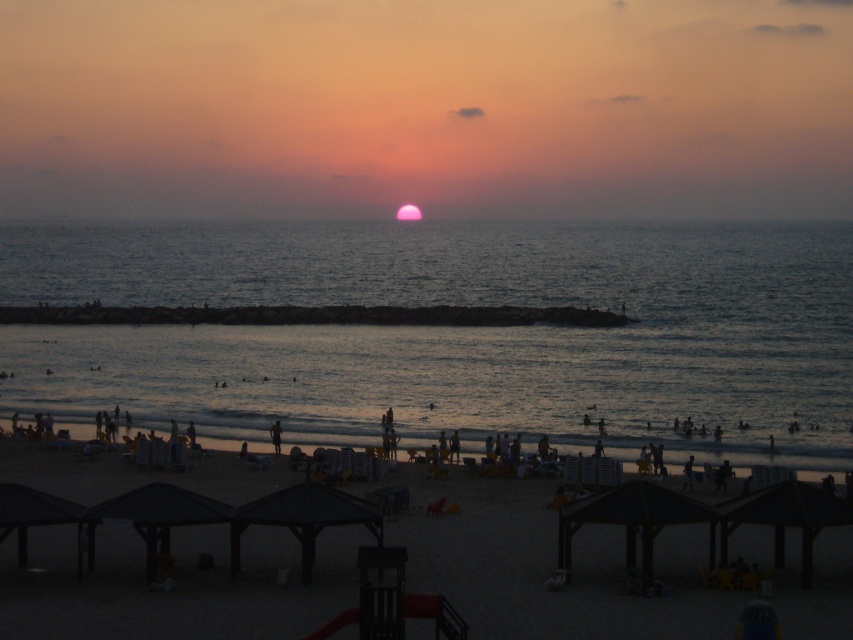
You are standing on the beach and see the point at coordinates (448, 330). Is this point located on the water or on the sand?

The point at coordinates (448, 330) is on blue water at center, so it is located on the water.

You are standing on the beach and want to take a photo of the blue water at center and the dark skin person at lower center. Which object should you focus on first if you want to include both in the frame without moving the camera?

The blue water at center is wider than the dark skin person at lower center, so you should focus on the blue water at center first to ensure it fits within the frame.

You are standing on the beach and want to walk from the dark wooden umbrellas at center to the blue water at center. Which direction should you face to walk straight towards the water?

You should face to the left because the blue water at center is to the left of dark wooden umbrellas at center.